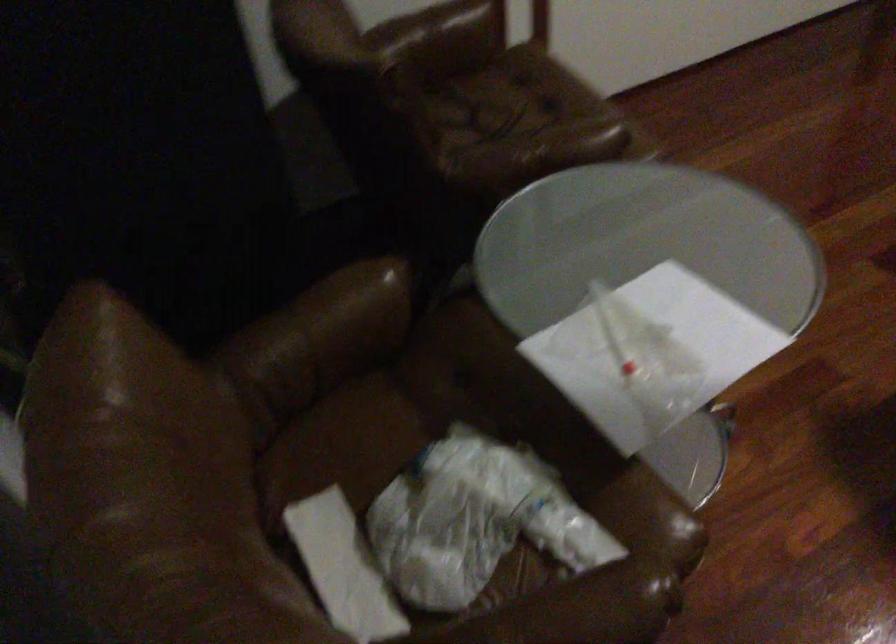
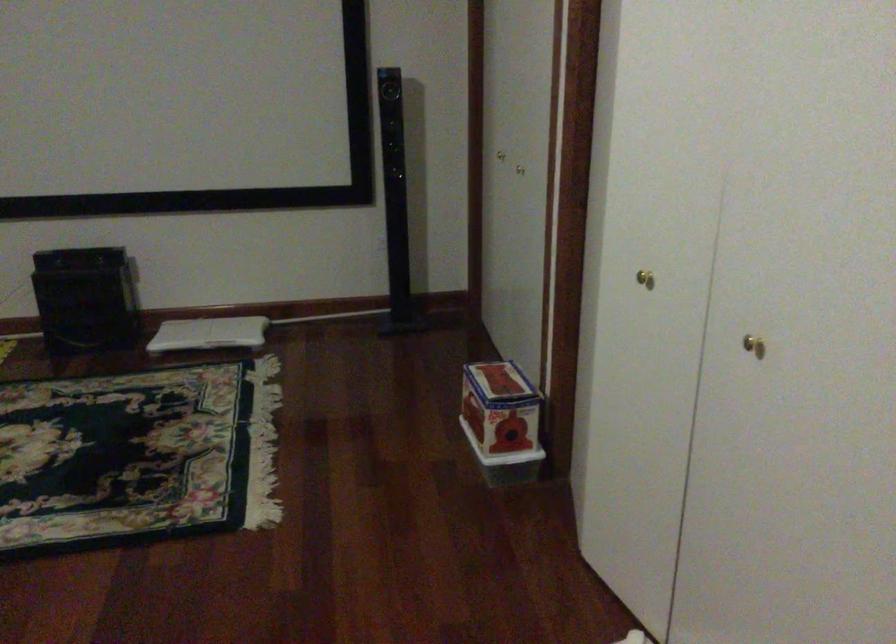
Question: Based on the continuous images, in which direction is the camera rotating? Reply with the corresponding letter.

Choices:
 (A) Left
 (B) Right
 (C) Up
 (D) Down

Answer: (B)